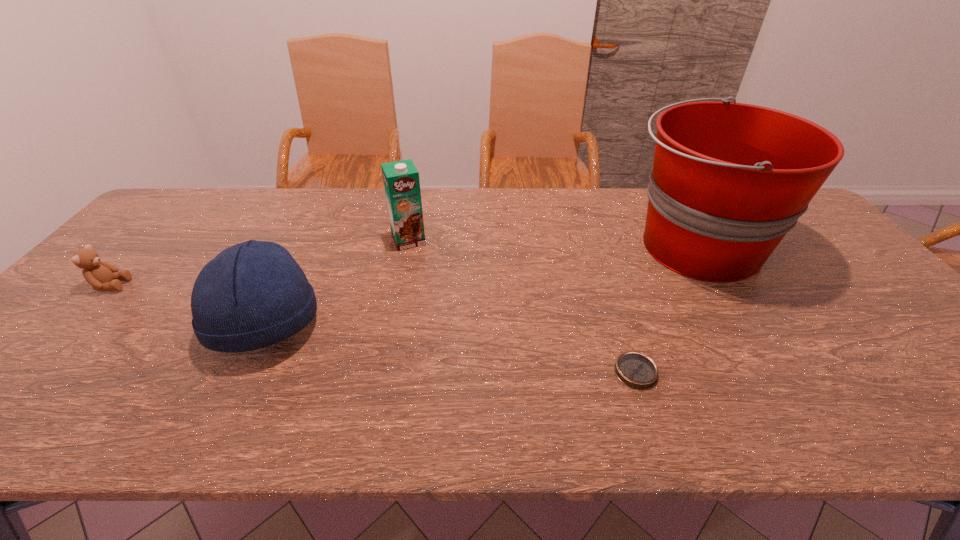
Where is `the tallest object`? the tallest object is located at coordinates (729, 180).

I want to click on bucket, so click(x=729, y=180).

Identify the location of carton. This screenshot has width=960, height=540. (401, 181).

Where is `the third object from right to left`? the third object from right to left is located at coordinates (401, 181).

This screenshot has height=540, width=960. In order to click on skullcap in this screenshot , I will do `click(254, 294)`.

The height and width of the screenshot is (540, 960). I want to click on the second object from left to right, so click(254, 294).

Where is `the leftmost object`? This screenshot has width=960, height=540. the leftmost object is located at coordinates (102, 276).

Where is `teddy bear`? teddy bear is located at coordinates (102, 276).

I want to click on compass, so click(636, 370).

I want to click on the shortest object, so click(x=636, y=370).